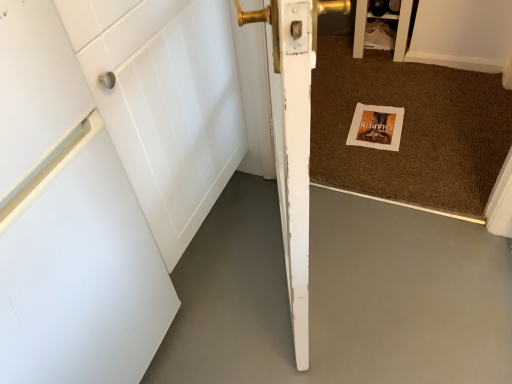
This screenshot has width=512, height=384. I want to click on spots to the right of white paper postcard at center, so click(432, 121).